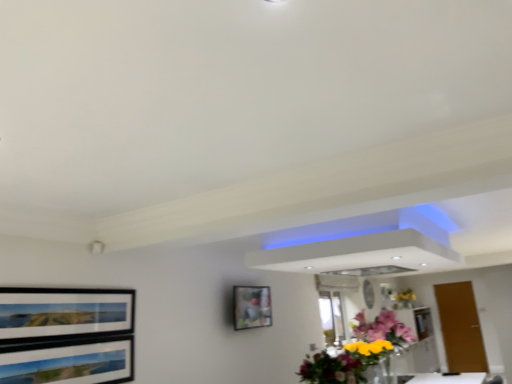
Question: From the image's perspective, is brown matte door at right located beneath translucent glass vase at upper right, which is the second flower from top to bottom?

Choices:
 (A) yes
 (B) no

Answer: (A)

Question: From a real-world perspective, is brown matte door at right physically below translucent glass vase at upper right, which appears as the second flower when viewed from the front?

Choices:
 (A) yes
 (B) no

Answer: (A)

Question: Is brown matte door at right closer to camera compared to translucent glass vase at upper right, the 1th flower in the bottom-to-top sequence?

Choices:
 (A) yes
 (B) no

Answer: (A)

Question: Are brown matte door at right and translucent glass vase at upper right, which is the second flower from top to bottom, making contact?

Choices:
 (A) yes
 (B) no

Answer: (B)

Question: Would you say brown matte door at right is a long distance from translucent glass vase at upper right, positioned as the 2th flower in left-to-right order?

Choices:
 (A) no
 (B) yes

Answer: (A)

Question: From their relative heights in the image, would you say vibrant floral bouquet at center, the 2th flower from the back, is taller or shorter than glossy floral bouquet at center?

Choices:
 (A) short
 (B) tall

Answer: (B)

Question: From a real-world perspective, is vibrant floral bouquet at center, which is the 1th flower in left-to-right order, positioned above or below glossy floral bouquet at center?

Choices:
 (A) above
 (B) below

Answer: (A)

Question: Does point (398, 336) appear closer or farther from the camera than point (311, 365)?

Choices:
 (A) closer
 (B) farther

Answer: (B)

Question: Is vibrant floral bouquet at center, which is the 1th flower from front to back, bigger or smaller than glossy floral bouquet at center?

Choices:
 (A) small
 (B) big

Answer: (B)

Question: Would you say brown matte door at right is to the left or to the right of matte black picture frame at center in the picture?

Choices:
 (A) right
 (B) left

Answer: (A)

Question: From a real-world perspective, is brown matte door at right physically located above or below matte black picture frame at center?

Choices:
 (A) above
 (B) below

Answer: (B)

Question: Do you think brown matte door at right is within matte black picture frame at center, or outside of it?

Choices:
 (A) inside
 (B) outside

Answer: (B)

Question: From the image's perspective, is brown matte door at right located above or below matte black picture frame at center?

Choices:
 (A) below
 (B) above

Answer: (A)

Question: Would you say glossy floral bouquet at center is to the left or to the right of brown matte door at right in the picture?

Choices:
 (A) left
 (B) right

Answer: (A)

Question: From their relative heights in the image, would you say glossy floral bouquet at center is taller or shorter than brown matte door at right?

Choices:
 (A) tall
 (B) short

Answer: (B)